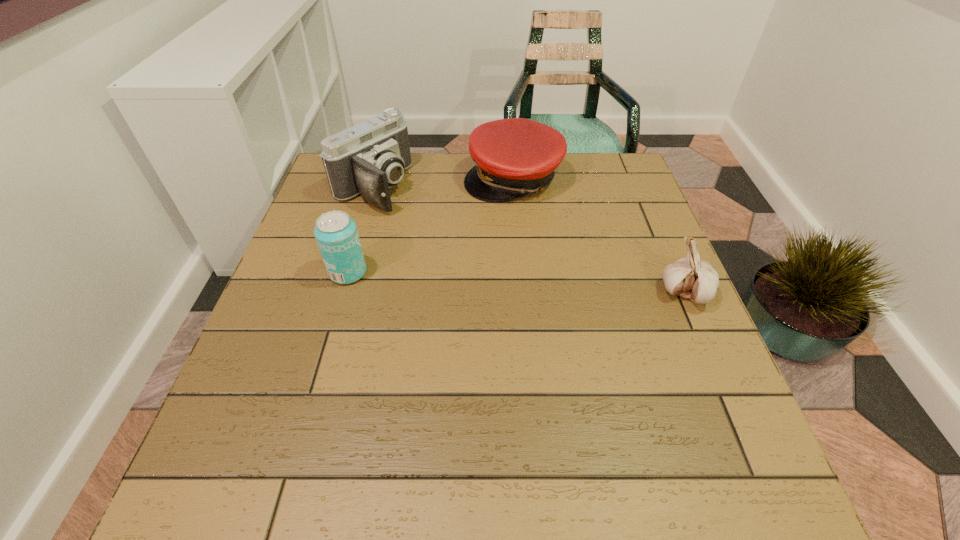
Locate an element on the screen. The width and height of the screenshot is (960, 540). beer can is located at coordinates (336, 234).

I want to click on garlic, so click(692, 278).

At what (x,y) coordinates should I click in order to perform the action: click on camera. Please return your answer as a coordinate pair (x, y). The height and width of the screenshot is (540, 960). Looking at the image, I should click on (369, 158).

The height and width of the screenshot is (540, 960). I want to click on the third object from left to right, so coord(513,157).

Where is `vacant space located 0.190m on the front of the beer can`? vacant space located 0.190m on the front of the beer can is located at coordinates (324, 358).

Where is `free space located 0.260m on the front of the garlic`? This screenshot has height=540, width=960. free space located 0.260m on the front of the garlic is located at coordinates (745, 431).

The width and height of the screenshot is (960, 540). I want to click on free space located at the front of the camera with an open lens cover, so click(427, 228).

Identify the location of vacant space located at the front of the camera with an open lens cover. The width and height of the screenshot is (960, 540). [455, 246].

Where is `vacant space located 0.050m at the front of the camera with an open lens cover`? vacant space located 0.050m at the front of the camera with an open lens cover is located at coordinates (406, 215).

The height and width of the screenshot is (540, 960). What are the coordinates of `vacant point located at the front of the second object from right to left where the visor is located` in the screenshot? It's located at (469, 297).